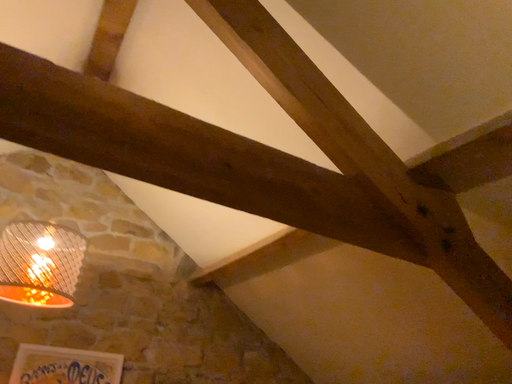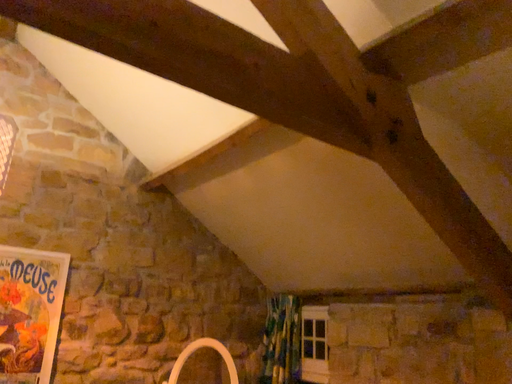
Question: Which way did the camera rotate in the video?

Choices:
 (A) rotated upward
 (B) rotated downward

Answer: (B)